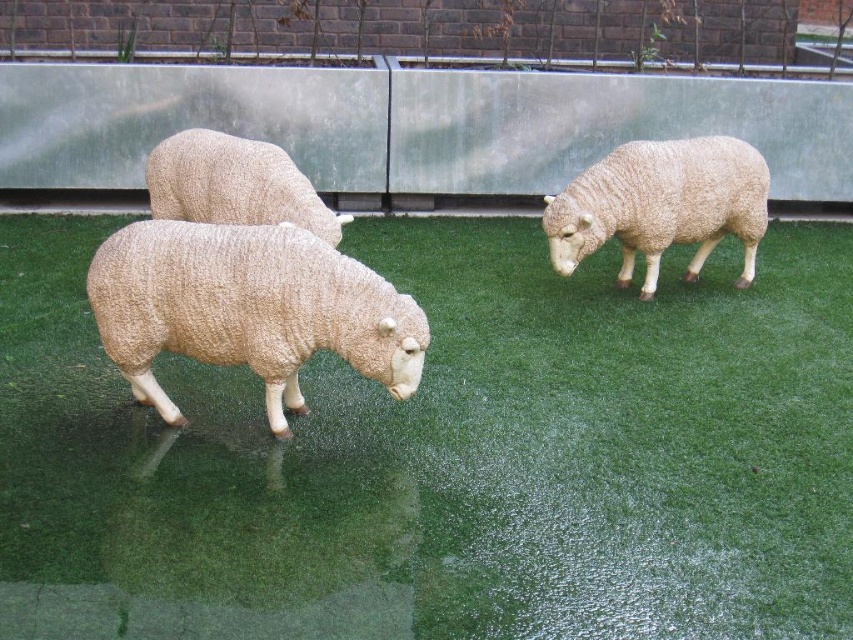
Question: Among these points, which one is farthest from the camera?

Choices:
 (A) (358, 348)
 (B) (395, 545)
 (C) (740, 276)

Answer: (C)

Question: Which point appears farthest from the camera in this image?

Choices:
 (A) (643, 140)
 (B) (206, 212)
 (C) (405, 577)
 (D) (340, 308)

Answer: (A)

Question: Can you confirm if green artificial grass at center is smaller than white woolen sheep at left?

Choices:
 (A) no
 (B) yes

Answer: (A)

Question: Does white woolen sheep at center have a lesser width compared to fuzzy woolen sheep at center?

Choices:
 (A) yes
 (B) no

Answer: (B)

Question: Does white woolen sheep at center have a larger size compared to fuzzy woolen sheep at center?

Choices:
 (A) no
 (B) yes

Answer: (B)

Question: Which is farther from the white woolen sheep at center?

Choices:
 (A) fuzzy woolen sheep at center
 (B) green artificial grass at center

Answer: (A)